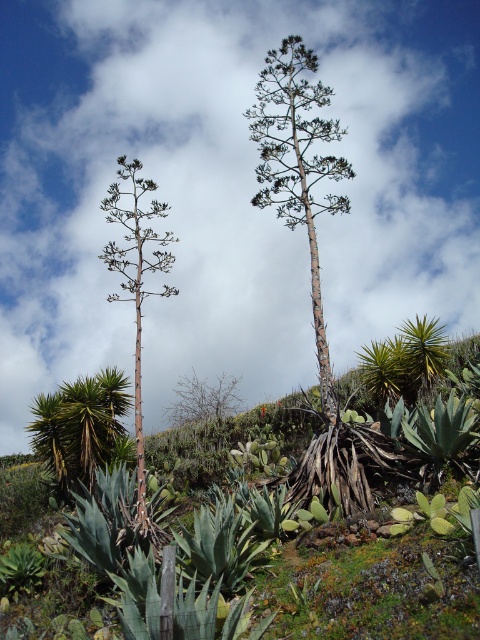
You are standing in the desert landscape and looking up at the sky. There is a point marked at coordinates (228, 188). What object is located at that point?

The point at coordinates (228, 188) corresponds to a white fluffy cloud at upper center.